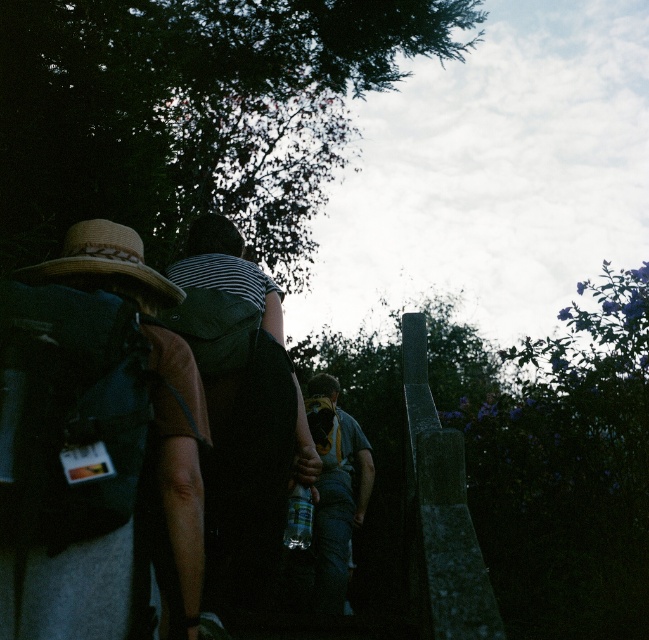
You are a photographer trying to capture a candid shot of the two people in the scene. You notice the striped fabric shirt at center and denim jeans at center. Which clothing item appears taller in the image?

The striped fabric shirt at center appears taller than the denim jeans at center in the image.